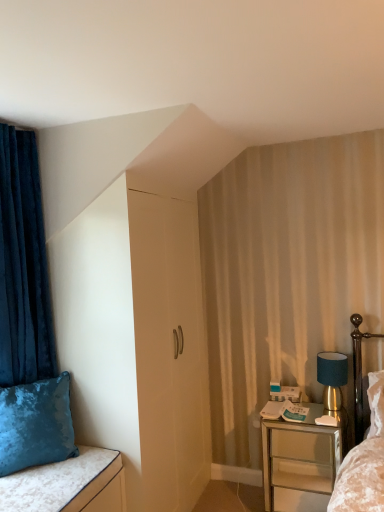
Question: Considering the relative positions of teal fabric lampshade at right and velvet blue pillow at lower left in the image provided, is teal fabric lampshade at right in front of velvet blue pillow at lower left?

Choices:
 (A) yes
 (B) no

Answer: (B)

Question: Would you say teal fabric lampshade at right contains velvet blue pillow at lower left?

Choices:
 (A) no
 (B) yes

Answer: (A)

Question: Is teal fabric lampshade at right next to velvet blue pillow at lower left?

Choices:
 (A) yes
 (B) no

Answer: (B)

Question: From a real-world perspective, does teal fabric lampshade at right stand above velvet blue pillow at lower left?

Choices:
 (A) yes
 (B) no

Answer: (B)

Question: Is teal fabric lampshade at right positioned with its back to velvet blue pillow at lower left?

Choices:
 (A) no
 (B) yes

Answer: (A)

Question: In the image, is velvet cushion at lower left on the left side or the right side of metallic silver nightstand at lower right?

Choices:
 (A) left
 (B) right

Answer: (A)

Question: Looking at their shapes, would you say velvet cushion at lower left is wider or thinner than metallic silver nightstand at lower right?

Choices:
 (A) wide
 (B) thin

Answer: (A)

Question: Does point (9, 488) appear closer or farther from the camera than point (292, 473)?

Choices:
 (A) closer
 (B) farther

Answer: (A)

Question: In the image, is velvet cushion at lower left positioned in front of or behind metallic silver nightstand at lower right?

Choices:
 (A) front
 (B) behind

Answer: (A)

Question: From a real-world perspective, is velvet blue pillow at lower left above or below teal fabric lampshade at right?

Choices:
 (A) above
 (B) below

Answer: (A)

Question: Considering the positions of velvet blue pillow at lower left and teal fabric lampshade at right in the image, is velvet blue pillow at lower left wider or thinner than teal fabric lampshade at right?

Choices:
 (A) thin
 (B) wide

Answer: (B)

Question: Is velvet blue pillow at lower left to the left or to the right of teal fabric lampshade at right in the image?

Choices:
 (A) right
 (B) left

Answer: (B)

Question: Looking at the image, does velvet blue pillow at lower left seem bigger or smaller compared to teal fabric lampshade at right?

Choices:
 (A) small
 (B) big

Answer: (B)

Question: Is metallic silver nightstand at lower right taller or shorter than velvet blue pillow at lower left?

Choices:
 (A) tall
 (B) short

Answer: (A)

Question: Choose the correct answer: Is metallic silver nightstand at lower right inside velvet blue pillow at lower left or outside it?

Choices:
 (A) outside
 (B) inside

Answer: (A)